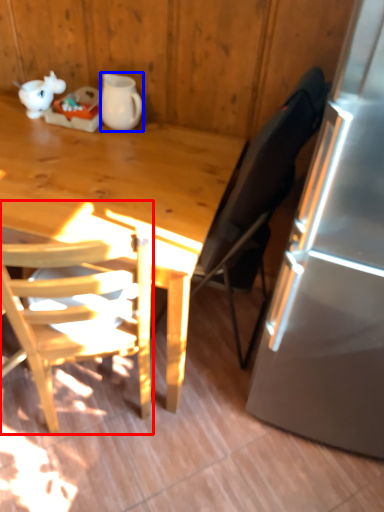
Question: Which object appears closest to the camera in this image, chair (highlighted by a red box) or pitcher (highlighted by a blue box)?

Choices:
 (A) chair
 (B) pitcher

Answer: (A)